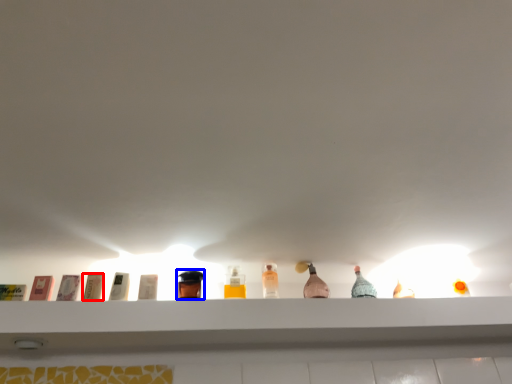
Question: Which object appears closest to the camera in this image, toiletry (highlighted by a red box) or toiletry (highlighted by a blue box)?

Choices:
 (A) toiletry
 (B) toiletry

Answer: (A)